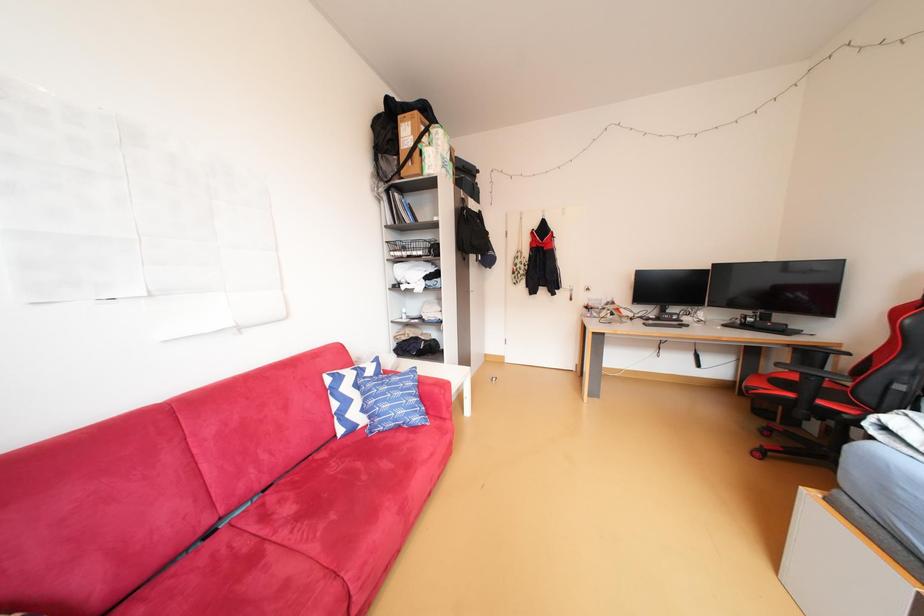
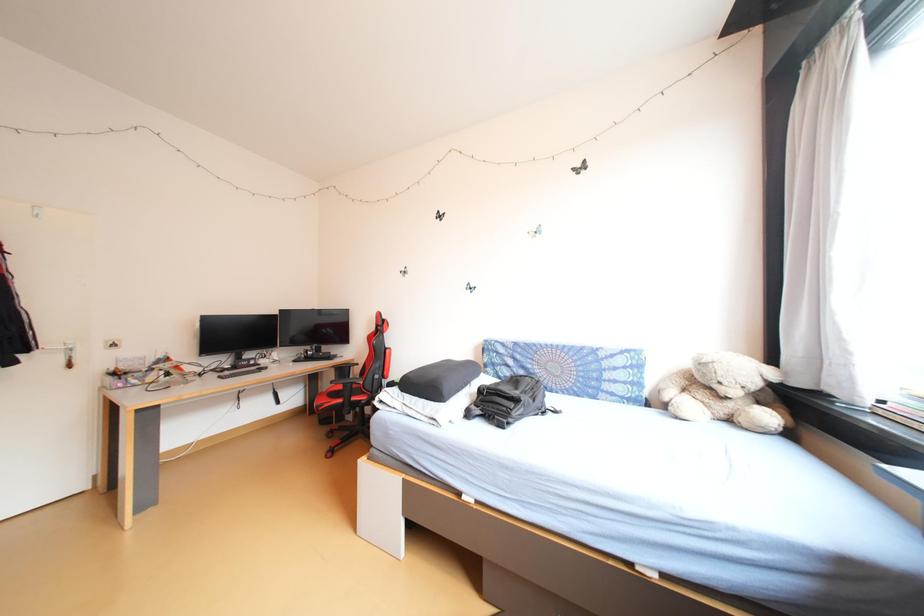
Question: The first image is from the beginning of the video and the second image is from the end. How did the camera likely rotate when shooting the video?

Choices:
 (A) Left
 (B) Right
 (C) Up
 (D) Down

Answer: (B)